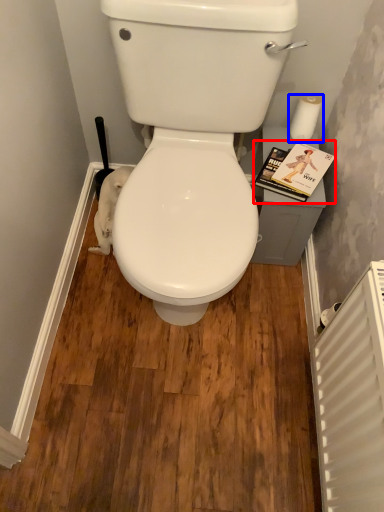
Question: Which point is further to the camera, paperback book (highlighted by a red box) or toilet paper (highlighted by a blue box)?

Choices:
 (A) paperback book
 (B) toilet paper

Answer: (B)